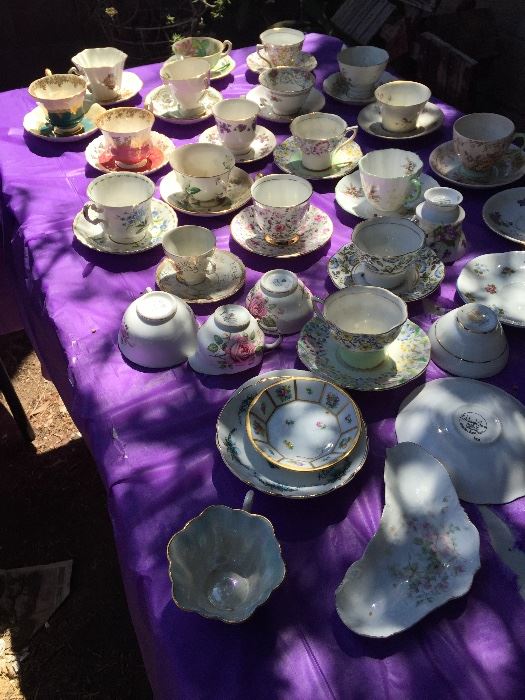
This screenshot has height=700, width=525. Find the location of `teacups without saucers`. teacups without saucers is located at coordinates (242, 559), (166, 328), (245, 336), (285, 288), (455, 349).